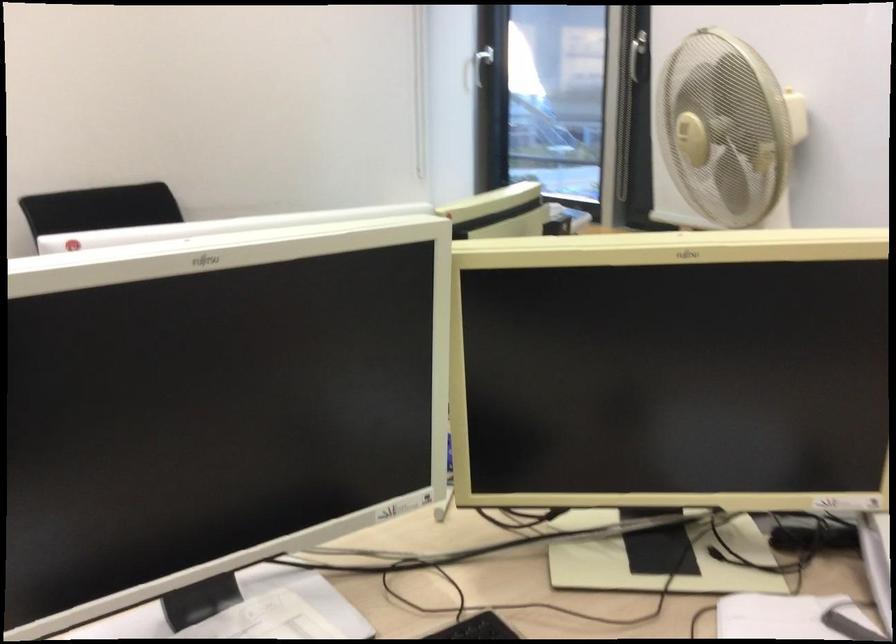
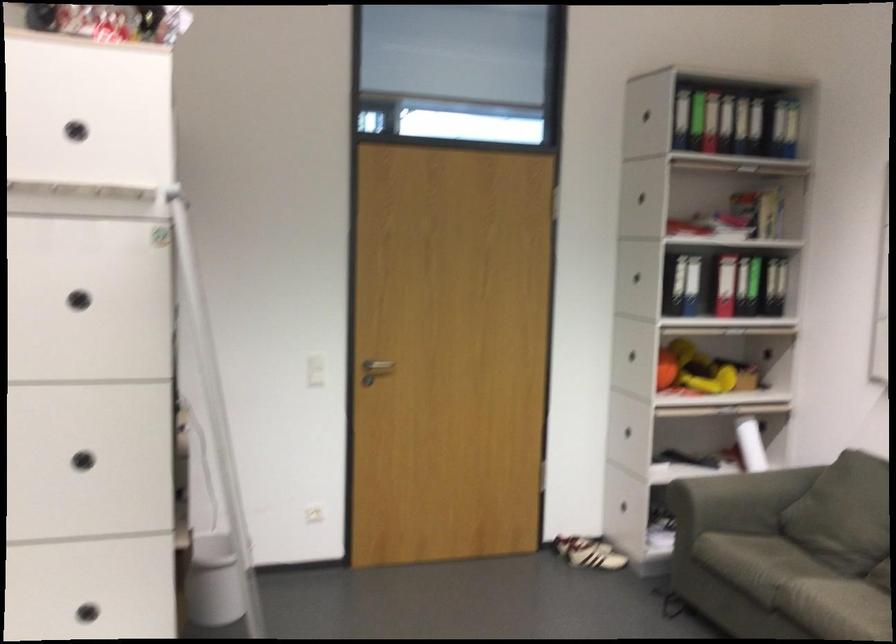
Question: The camera is either moving clockwise (left) or counter-clockwise (right) around the object. The first image is from the beginning of the video and the second image is from the end. Is the camera moving left or right when shooting the video?

Choices:
 (A) Left
 (B) Right

Answer: (B)